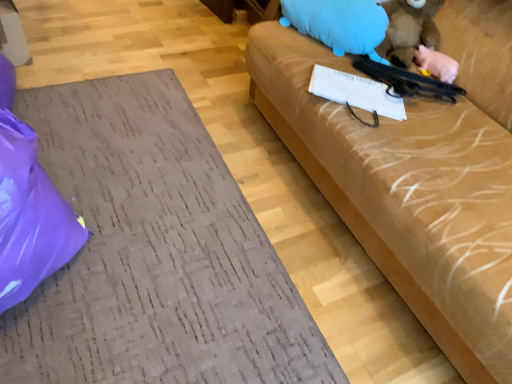
The image size is (512, 384). In order to click on free space above matte brown couch at right (from a real-world perspective) in this screenshot , I will do `click(149, 238)`.